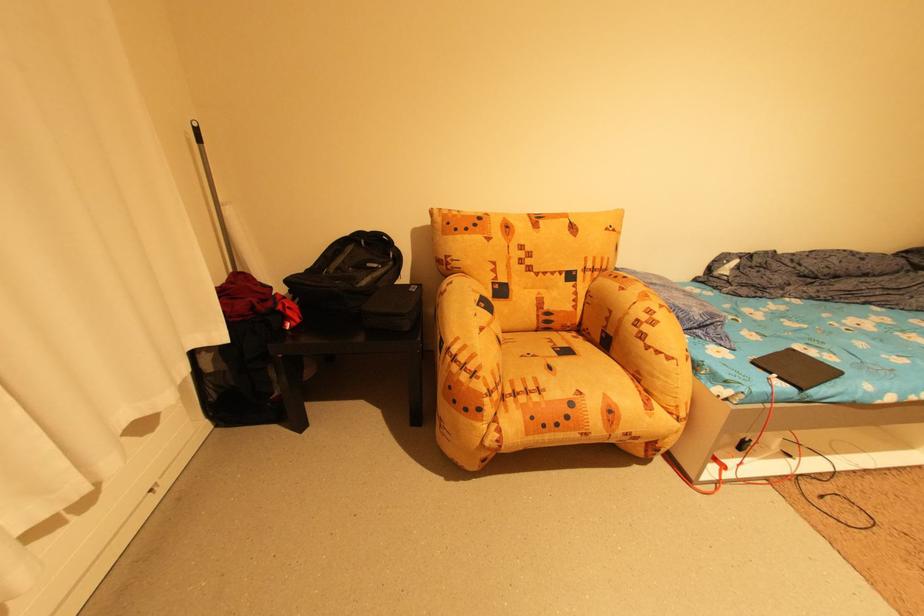
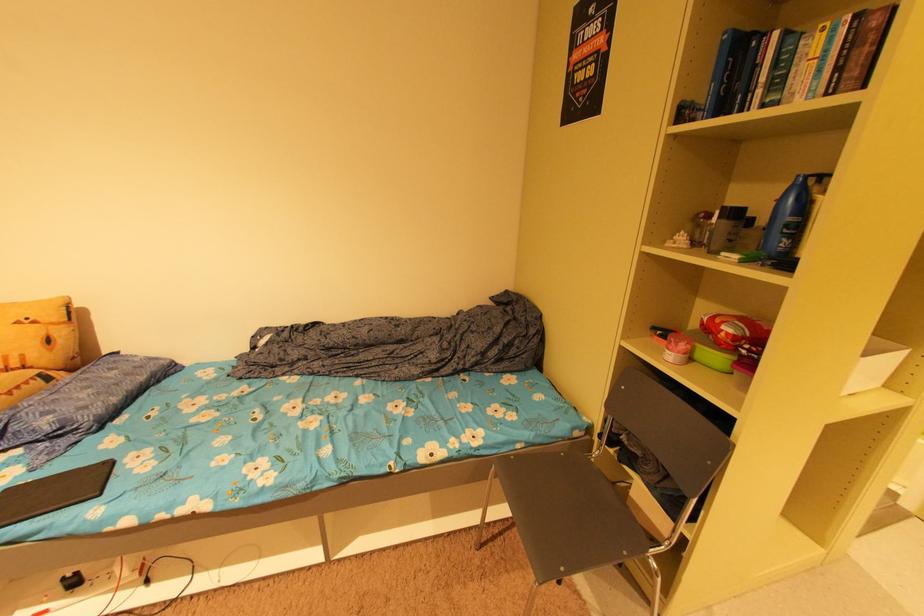
Question: Which direction would the cameraman need to move to produce the second image? Reply with the corresponding letter.

Choices:
 (A) Left
 (B) Right
 (C) Forward
 (D) Backward

Answer: (B)